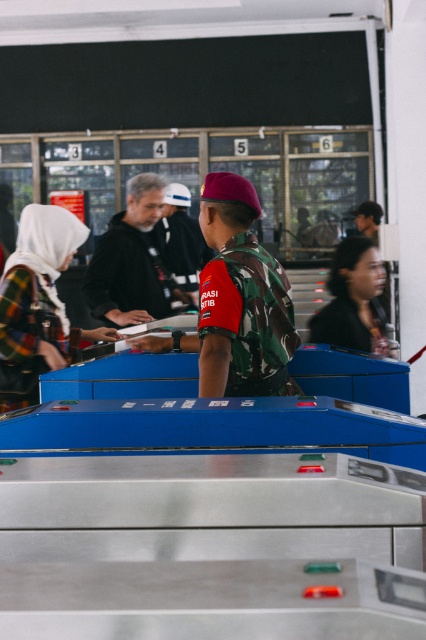
Consider the image. You are a security officer at the transportation hub. You need to determine which of the two individuals at the center has a wider clothing item. Which one has a wider width between the dark gray hoodie at center and the camouflage uniform at center?

The dark gray hoodie at center has a greater width than the camouflage uniform at center according to the description.

You are an observer at the transportation hub. You notice two people in the scene, one wearing a plaid fabric hijab at left and another with dark brown hair at center. Which of these two has a wider width in the image?

The plaid fabric hijab at left has a greater width than the dark brown hair at center.